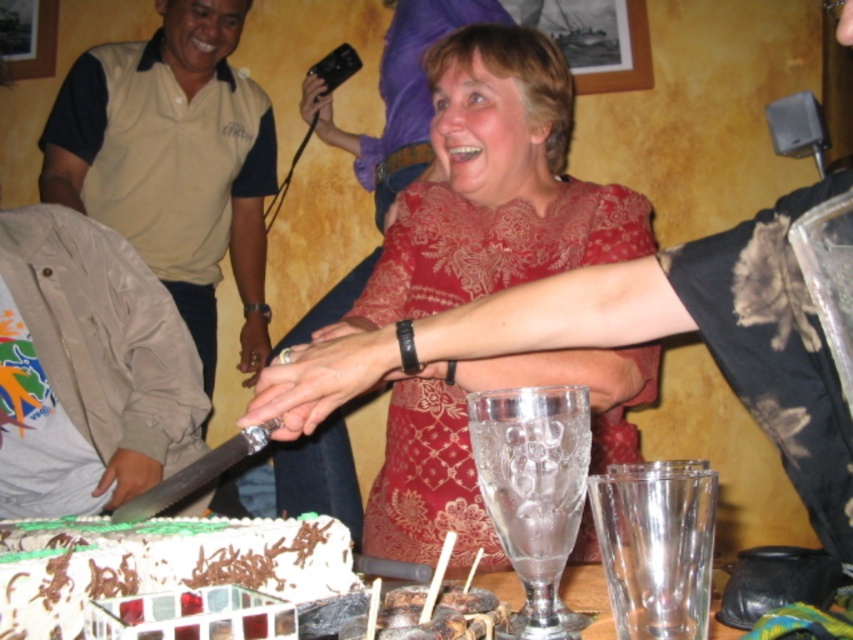
Question: Which point is closer to the camera?

Choices:
 (A) matte red dress at center
 (B) beige cotton shirt at left
 (C) white chocolate cake at lower left
 (D) translucent glass cups at lower center

Answer: (D)

Question: Is matte red dress at center below white chocolate cake at lower left?

Choices:
 (A) yes
 (B) no

Answer: (B)

Question: Which object is the farthest from the translucent glass cups at lower center?

Choices:
 (A) white chocolate cake at lower left
 (B) matte red dress at center
 (C) beige cotton shirt at left

Answer: (C)

Question: Which object is closer to the camera taking this photo?

Choices:
 (A) white chocolate cake at lower left
 (B) translucent glass cups at lower center
 (C) matte red dress at center

Answer: (B)

Question: Is white chocolate cake at lower left to the right of translucent glass cups at lower center from the viewer's perspective?

Choices:
 (A) no
 (B) yes

Answer: (A)

Question: Is beige cotton shirt at left bigger than translucent glass cups at lower center?

Choices:
 (A) yes
 (B) no

Answer: (A)